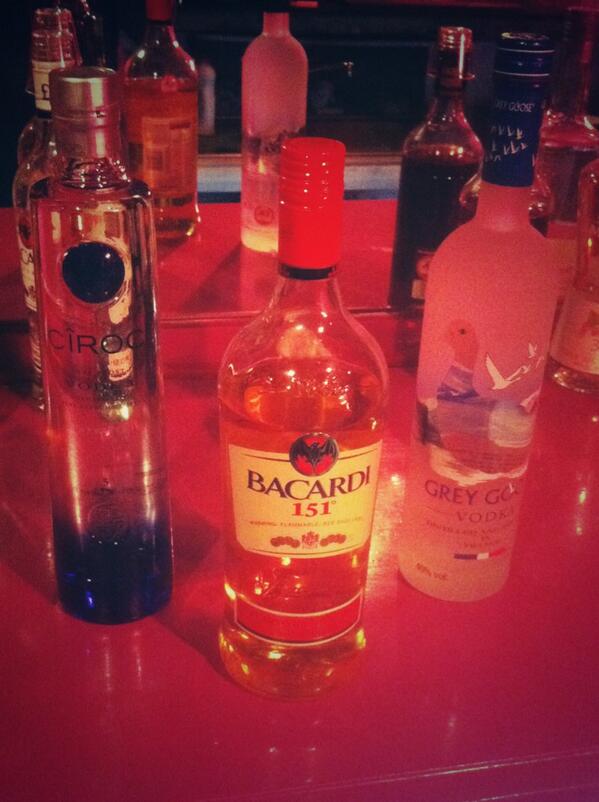
Find the location of a particular element. The image size is (599, 802). vodka bottle is located at coordinates (40, 165).